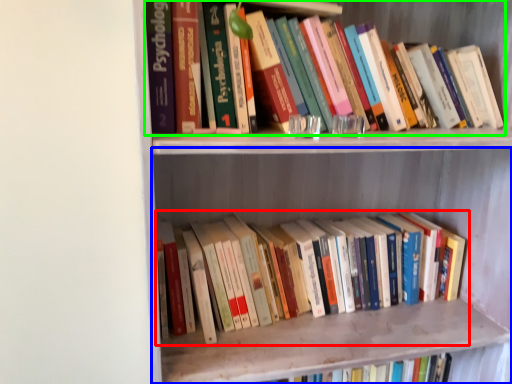
Question: Which object is positioned farthest from book (highlighted by a red box)? Select from shelf (highlighted by a blue box) and book (highlighted by a green box).

Choices:
 (A) shelf
 (B) book

Answer: (B)